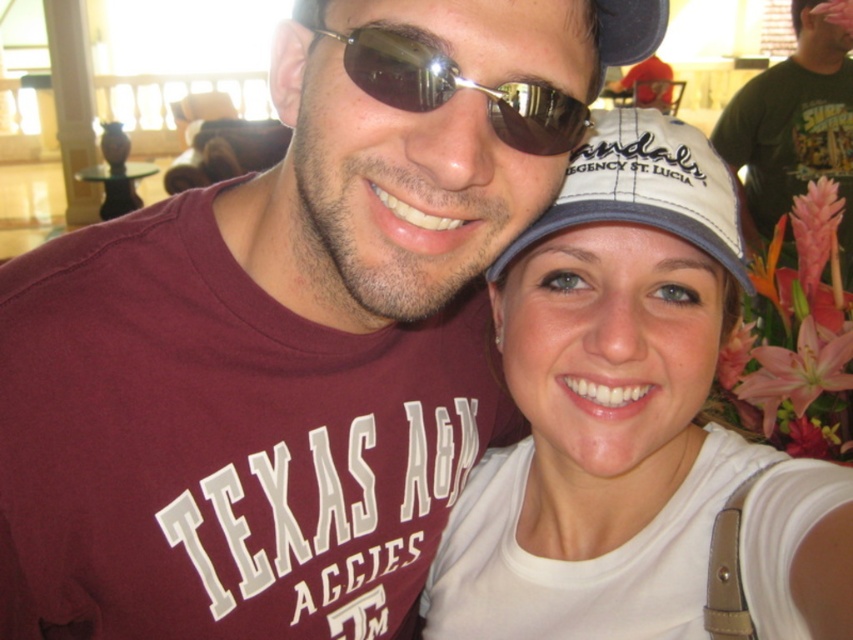
Question: Among these objects, which one is nearest to the camera?

Choices:
 (A) white fabric baseball cap at center
 (B) sunglasses at center

Answer: (B)

Question: Does white matte cap at upper right have a lesser width compared to sunglasses at center?

Choices:
 (A) no
 (B) yes

Answer: (A)

Question: Can you confirm if white matte cap at upper right is thinner than black fabric cap at upper center?

Choices:
 (A) no
 (B) yes

Answer: (A)

Question: Which point is closer to the camera?

Choices:
 (A) white matte cap at upper right
 (B) white fabric baseball cap at center

Answer: (A)

Question: Which point is farther from the camera taking this photo?

Choices:
 (A) (393, 77)
 (B) (651, 13)

Answer: (B)

Question: Can you confirm if white matte cap at upper right is thinner than black fabric cap at upper center?

Choices:
 (A) yes
 (B) no

Answer: (B)